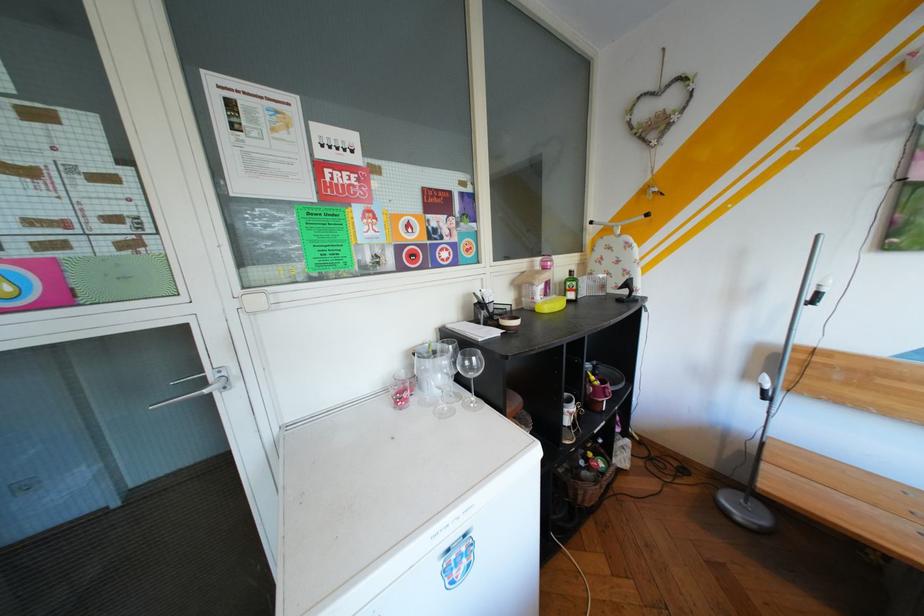
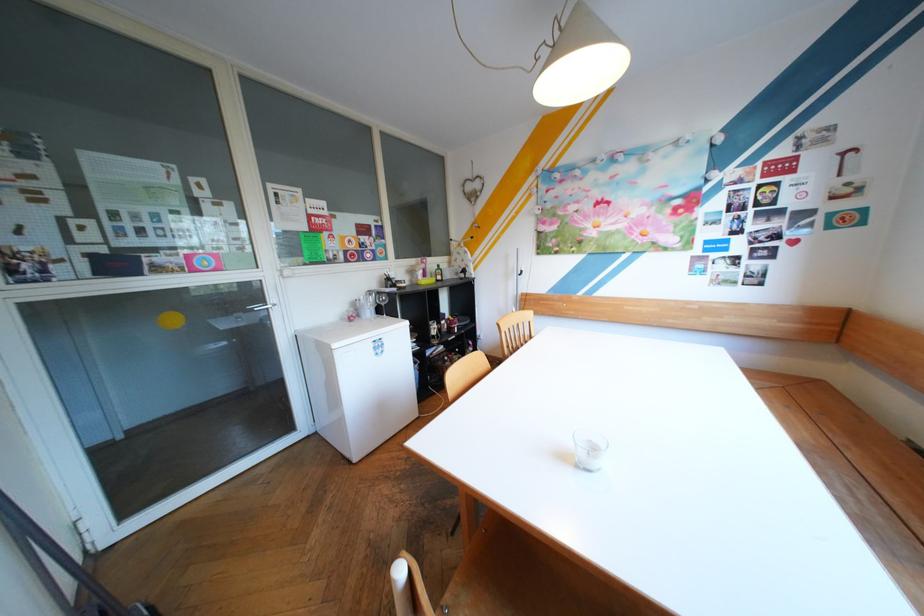
Find the pixel in the second image that matches (x=533, y=264) in the first image.

(426, 261)